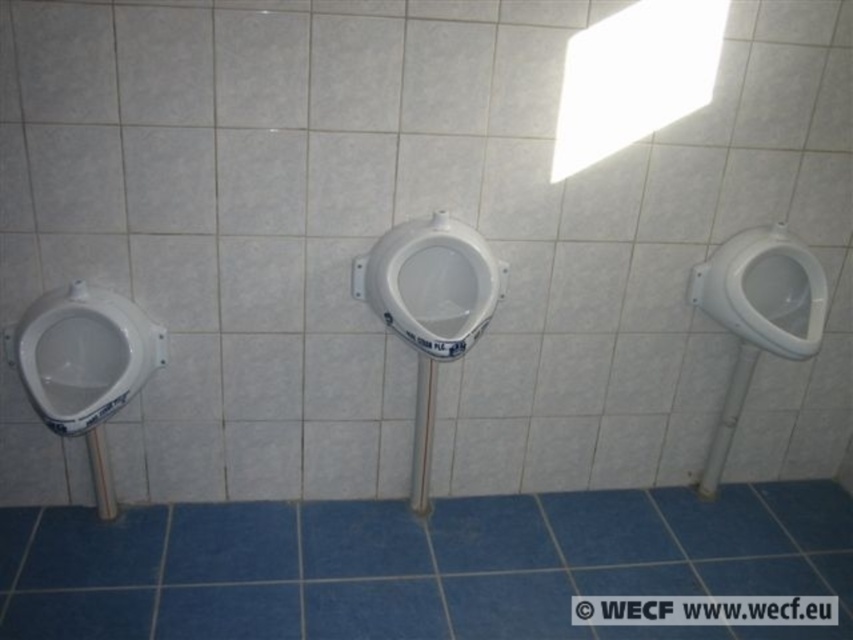
You are a maintenance worker inspecting the restroom. You need to replace the smaller toilet bowl. Which one should you choose between the white glossy toilet bowl at left and the white glossy toilet bowl at center?

The white glossy toilet bowl at left is smaller than the white glossy toilet bowl at center, so you should choose the white glossy toilet bowl at left to replace.

You are standing in the restroom and need to use the facilities. There is a white glossy toilet bowl at left and three urinals mounted on the tiled wall. Based on their positions, which facility is closer to you?

The white glossy toilet bowl at left is closer to you since it is positioned at point (83, 355), which is nearer than the urinals mounted on the tiled wall.

You are a maintenance worker inspecting the restroom. You need to check the height of the white glossy toilet bowl at left and the white glossy toilet bowl at center. Which one is shorter?

The white glossy toilet bowl at left is shorter than the white glossy toilet bowl at center according to the description.